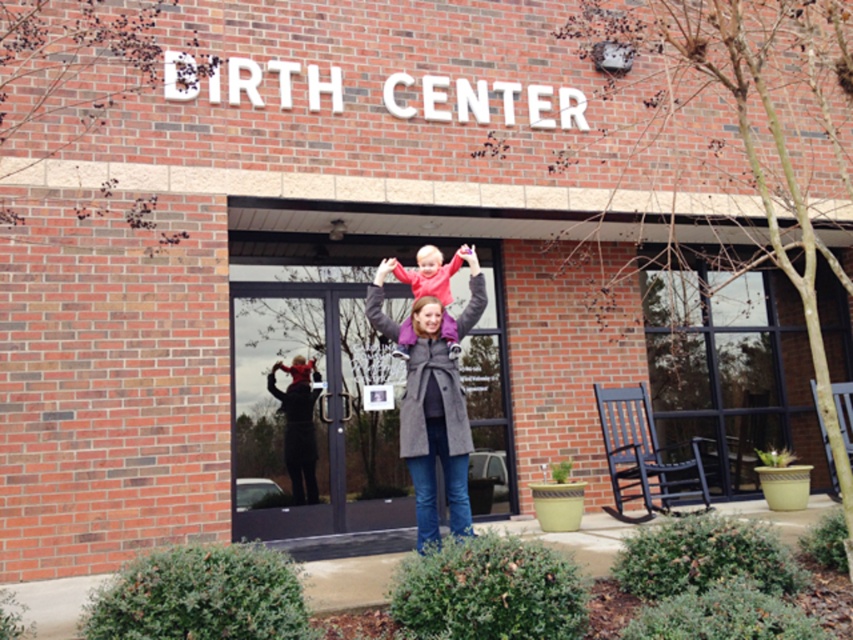
Consider the image. Is transparent glass door at center wider than matte pink sweater at center?

Yes, transparent glass door at center is wider than matte pink sweater at center.

Who is positioned more to the left, transparent glass door at center or matte pink sweater at center?

Positioned to the left is transparent glass door at center.

The image size is (853, 640). Describe the element at coordinates (314, 410) in the screenshot. I see `transparent glass door at center` at that location.

The image size is (853, 640). In order to click on transparent glass door at center in this screenshot , I will do pyautogui.click(x=314, y=410).

Which of these two, matte gray coat at center or dark blue wooden rocking chair at right, stands taller?

matte gray coat at center

Is point (451, 412) behind point (611, 419)?

No, (451, 412) is in front of (611, 419).

The height and width of the screenshot is (640, 853). I want to click on matte gray coat at center, so click(434, 426).

Is matte gray coat at center bigger than matte pink sweater at center?

Indeed, matte gray coat at center has a larger size compared to matte pink sweater at center.

Which is in front, point (427, 435) or point (434, 262)?

Point (427, 435)

Where is `matte gray coat at center`? This screenshot has width=853, height=640. matte gray coat at center is located at coordinates pos(434,426).